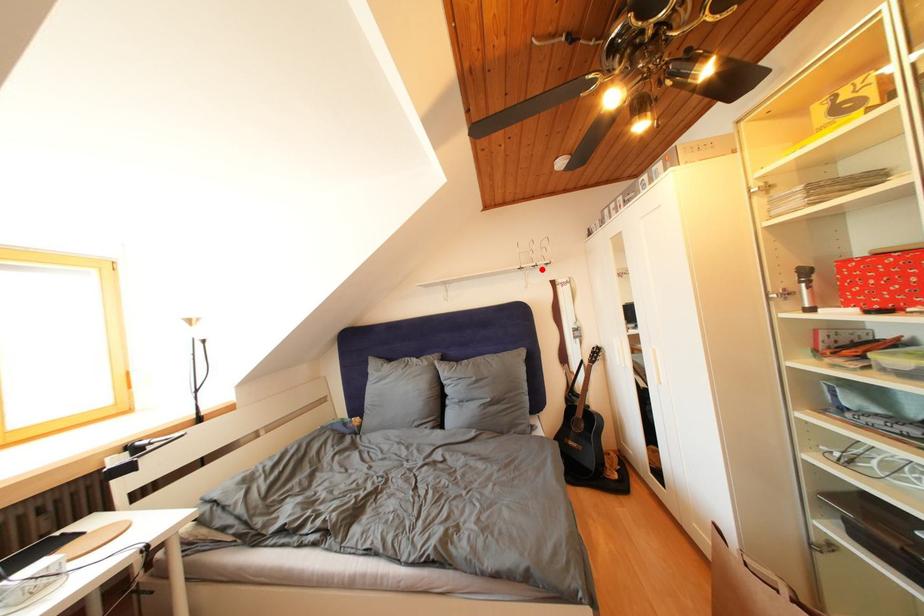
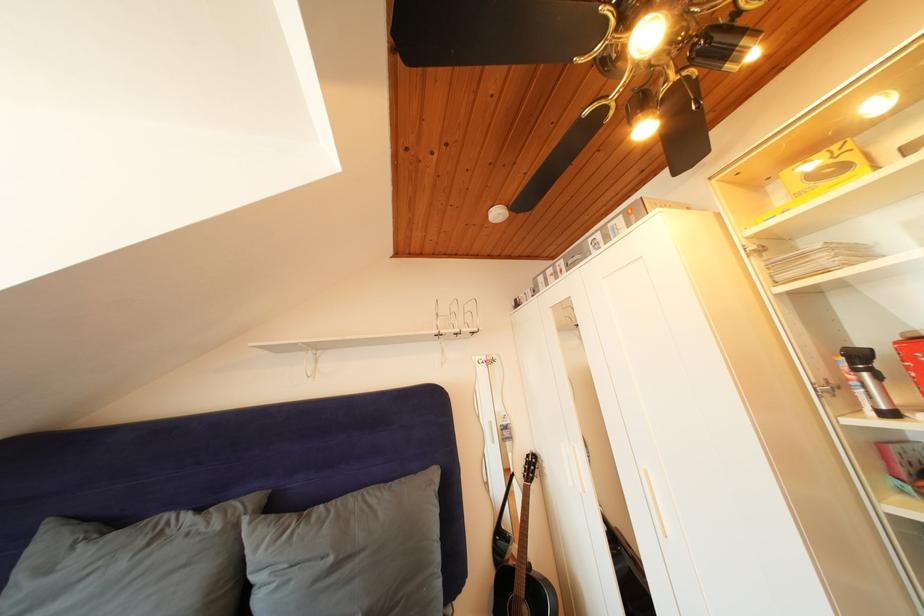
Where in the second image is the point corresponding to the highlighted location from the first image?

(466, 336)